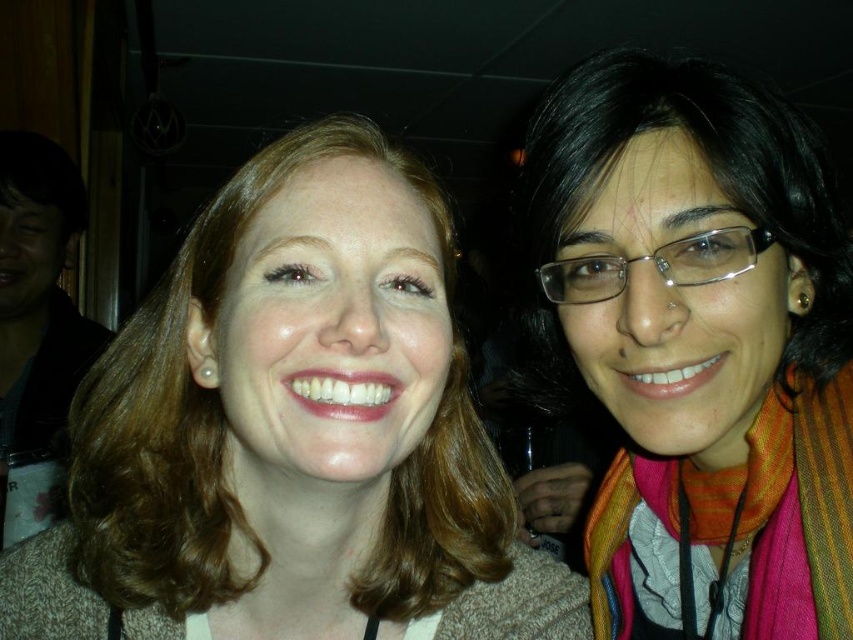
You are a photographer trying to focus on the multicolored scarf at right and the multicolored woven scarf at right in the image. Which one do you need to adjust your camera focus for first?

The multicolored scarf at right is closer to the viewer than the multicolored woven scarf at right, so you should focus on the multicolored scarf at right first before adjusting for the multicolored woven scarf at right.

You are a photographer standing 12 inches away from the matte brown hair at center. Do you need to move closer or farther to avoid being too close according to the safety guideline of maintaining at least 15 inches distance?

The matte brown hair at center and viewer are 14.82 inches apart. Since you are currently 12 inches away, you need to move farther away to meet the 15 inches safety guideline.